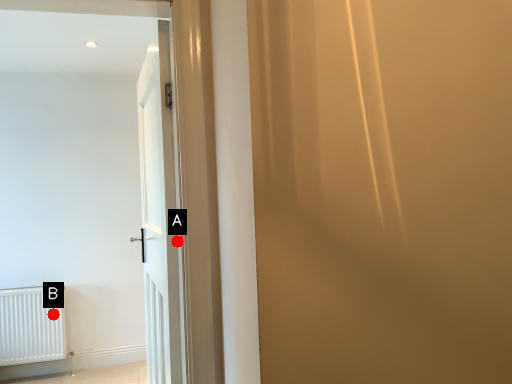
Question: Two points are circled on the image, labeled by A and B beside each circle. Which of the following is the closest to the observer?

Choices:
 (A) A is closer
 (B) B is closer

Answer: (A)